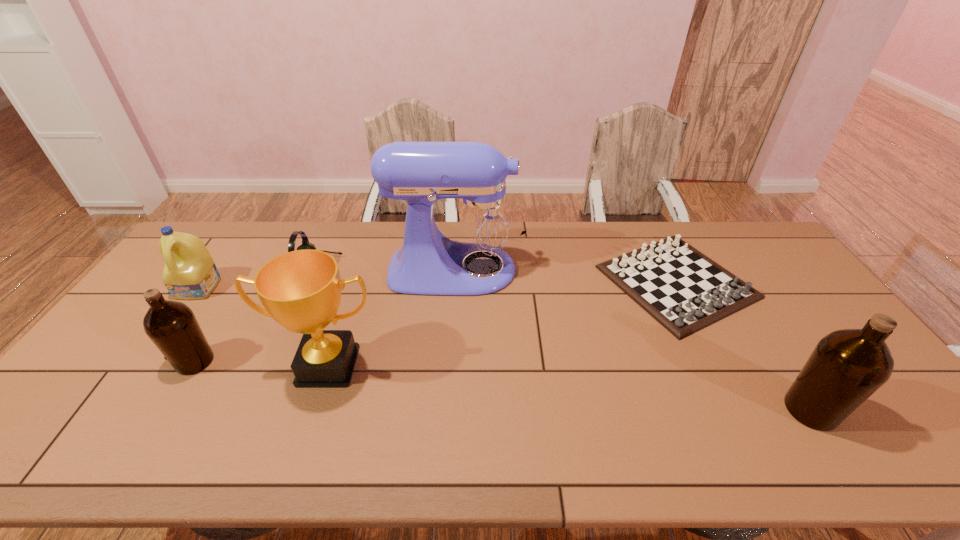
Image resolution: width=960 pixels, height=540 pixels. Identify the location of headset that is at the far edge. (305, 242).

Where is `olive oil at the near edge`? This screenshot has width=960, height=540. olive oil at the near edge is located at coordinates (847, 366).

The width and height of the screenshot is (960, 540). What are the coordinates of `award at the near edge` in the screenshot? It's located at [x=301, y=290].

I want to click on object that is at the left edge, so click(x=190, y=273).

Where is `olive oil situated at the right edge`? olive oil situated at the right edge is located at coordinates (847, 366).

Identify the location of chessboard located in the right edge section of the desktop. (685, 291).

Where is `object present at the far right corner`? This screenshot has width=960, height=540. object present at the far right corner is located at coordinates 685,291.

I want to click on object at the near right corner, so click(x=847, y=366).

This screenshot has height=540, width=960. What are the coordinates of `vacant space at the far edge` in the screenshot? It's located at (724, 261).

In the image, there is a desktop. Where is `vacant space at the near edge`? vacant space at the near edge is located at coordinates (393, 405).